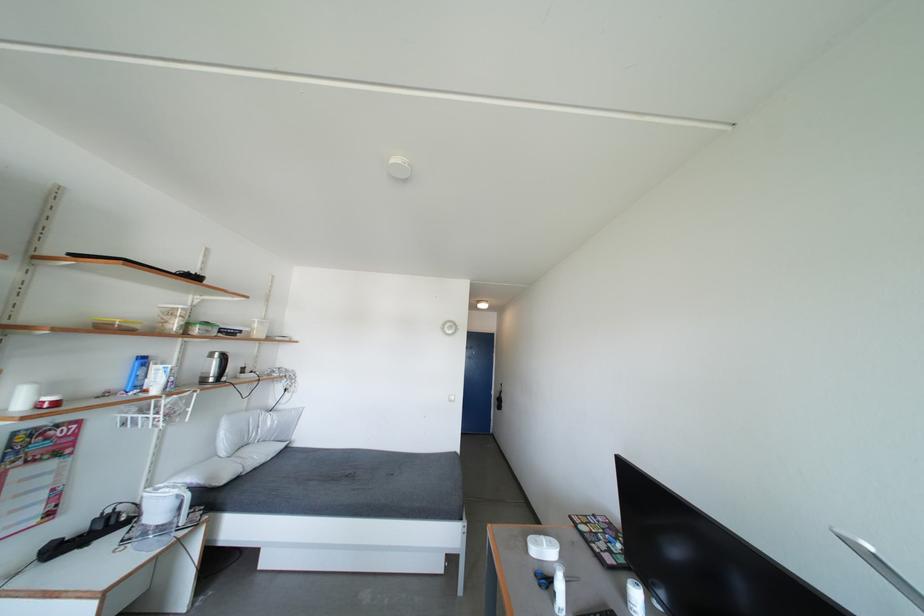
Image resolution: width=924 pixels, height=616 pixels. Find the location of `container with green lid`. container with green lid is located at coordinates (201, 328).